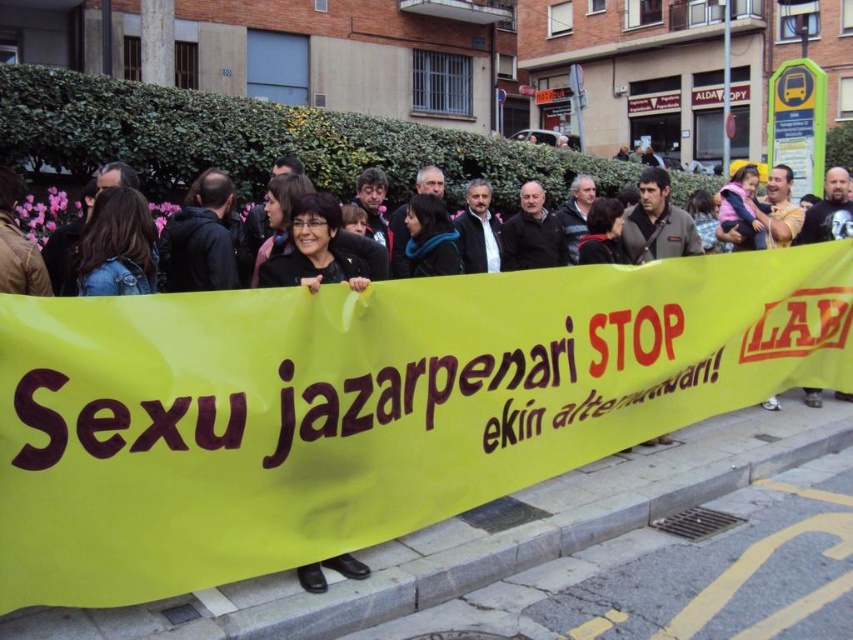
Question: Which of these objects is positioned farthest from the yellow fabric banner at center?

Choices:
 (A) matte black jacket at center
 (B) black fabric crowd at center

Answer: (A)

Question: Is yellow fabric banner at center wider than matte black jacket at center?

Choices:
 (A) yes
 (B) no

Answer: (A)

Question: Which point is closer to the camera?

Choices:
 (A) (764, 355)
 (B) (59, 275)
 (C) (276, 280)

Answer: (C)

Question: From the image, what is the correct spatial relationship of yellow fabric banner at center in relation to matte black jacket at center?

Choices:
 (A) right
 (B) left

Answer: (A)

Question: Estimate the real-world distances between objects in this image. Which object is farther from the yellow fabric banner at center?

Choices:
 (A) black fabric crowd at center
 (B) matte black jacket at center

Answer: (B)

Question: Is the position of matte black jacket at center more distant than that of black fabric crowd at center?

Choices:
 (A) yes
 (B) no

Answer: (B)